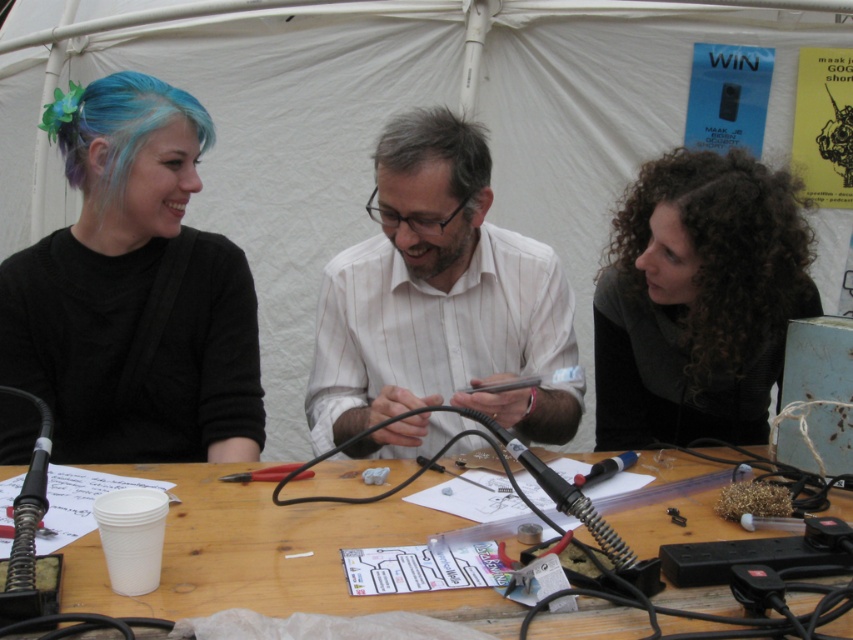
Can you confirm if white striped shirt at center is smaller than gray matte hair at center?

No.

Is white striped shirt at center below gray matte hair at center?

Correct, white striped shirt at center is located below gray matte hair at center.

Who is more forward, (462, 184) or (485, 150)?

Point (462, 184) is more forward.

Find the location of `white striped shirt at center`. white striped shirt at center is located at coordinates (439, 298).

Does white fabric tent at upper center appear under gray matte hair at center?

No.

Who is more forward, (38, 61) or (432, 131)?

Point (432, 131)

Is point (28, 205) positioned before point (466, 211)?

No, it is not.

What are the coordinates of `white fabric tent at upper center` in the screenshot? It's located at (412, 106).

Between point (131, 157) and point (152, 474), which one is positioned behind?

Positioned behind is point (131, 157).

Who is positioned more to the left, black matte hair at left or wooden table at center?

From the viewer's perspective, black matte hair at left appears more on the left side.

Is point (171, 161) positioned behind point (318, 536)?

Yes, point (171, 161) is behind point (318, 536).

Locate an element on the screen. black matte hair at left is located at coordinates (135, 294).